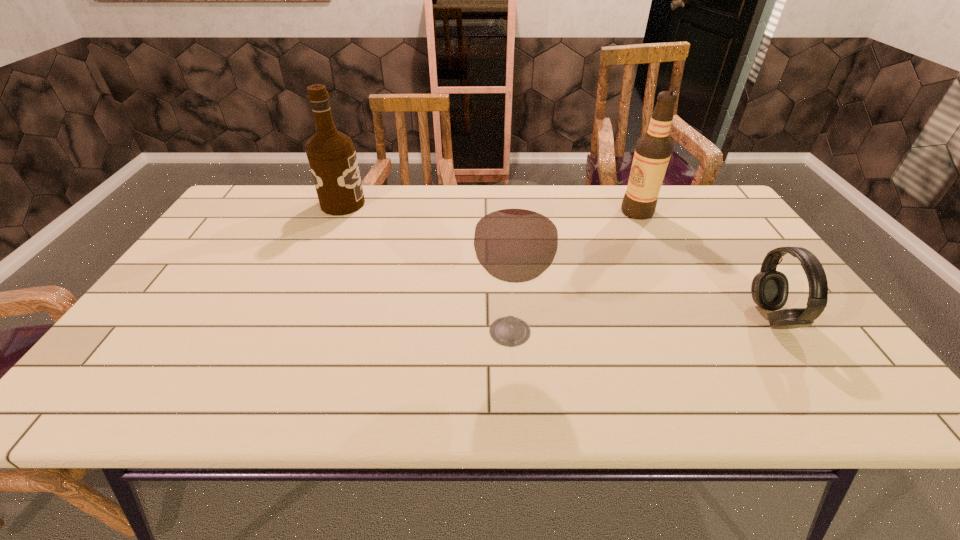
Identify the location of unoccupied position between the leftmost object and the second alcohol from left to right. Image resolution: width=960 pixels, height=540 pixels. (426, 268).

This screenshot has width=960, height=540. I want to click on vacant point located between the third object from right to left and the shortest object, so click(640, 324).

This screenshot has width=960, height=540. I want to click on vacant area between the second object from left to right and the leftmost object, so click(426, 268).

The height and width of the screenshot is (540, 960). In order to click on vacant region between the rightmost alcohol and the third object from right to left in this screenshot , I will do `click(573, 272)`.

Find the location of `blank region between the second alcohol from right to left and the leftmost object`. blank region between the second alcohol from right to left and the leftmost object is located at coordinates (426, 268).

Locate an element on the screen. This screenshot has width=960, height=540. free space that is in between the shortest object and the second object from right to left is located at coordinates (705, 265).

Find the location of a particular element. This screenshot has width=960, height=540. free space between the rightmost alcohol and the second object from left to right is located at coordinates (573, 272).

Where is `object that is the closest to the rightmost alcohol`? This screenshot has width=960, height=540. object that is the closest to the rightmost alcohol is located at coordinates (770, 288).

Where is `object that stands as the third closest to the second alcohol from left to right`? The image size is (960, 540). object that stands as the third closest to the second alcohol from left to right is located at coordinates (332, 158).

Identify which alcohol is the second nearest to the nearest alcohol. Please provide its 2D coordinates. Your answer should be formatted as a tuple, i.e. [(x, y)], where the tuple contains the x and y coordinates of a point satisfying the conditions above.

[(332, 158)]